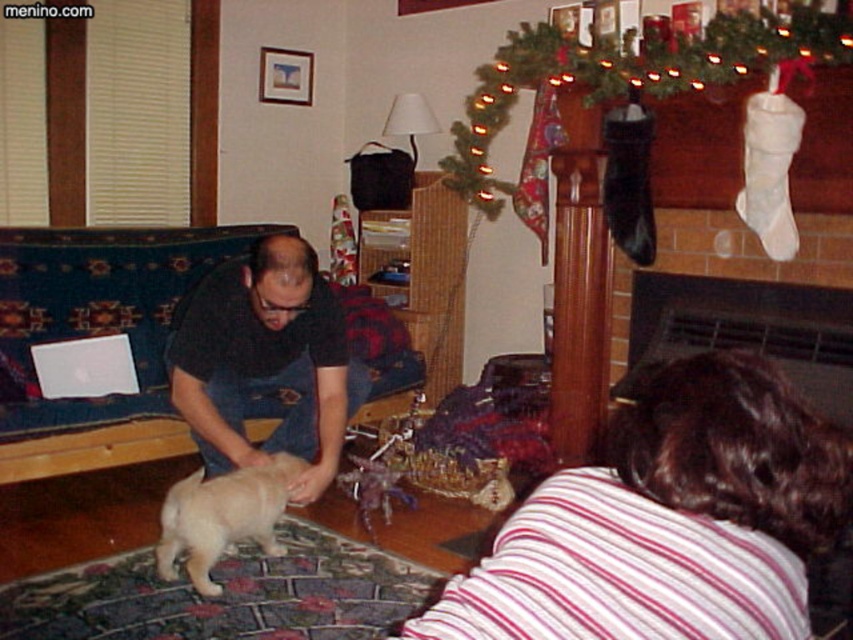
In the festive living room scene, there is a blue fabric couch at left and a light beige fur at center. Which object is wider?

The blue fabric couch at left is wider than the light beige fur at center.

You are standing in the living room and want to place a small decoration between the two points labeled as point (10, 243) and point (840, 131). According to the scene, which point is closer to you so that you can place the decoration in front of it?

Point (840, 131) is closer to you because it is in front of point (10, 243), so you should place the decoration in front of point (840, 131).